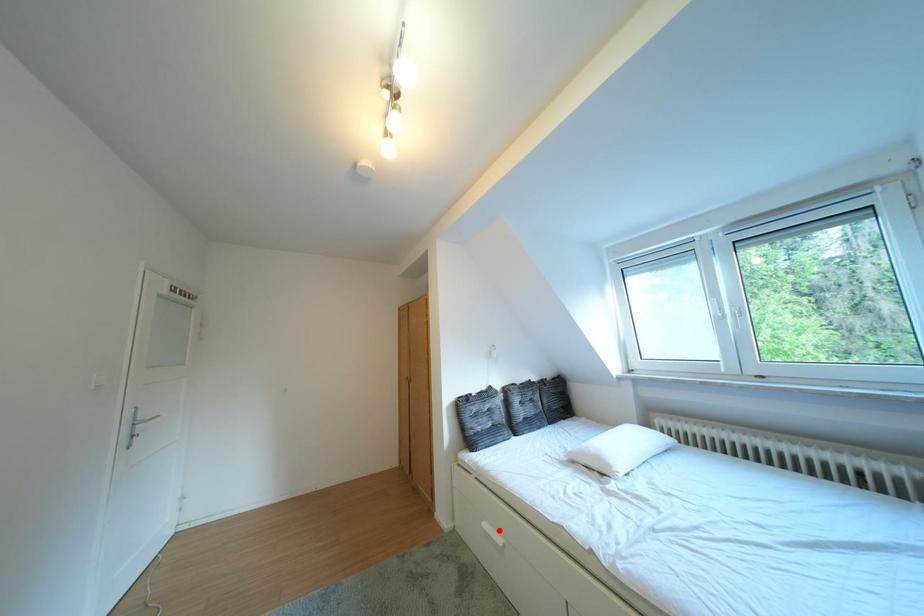
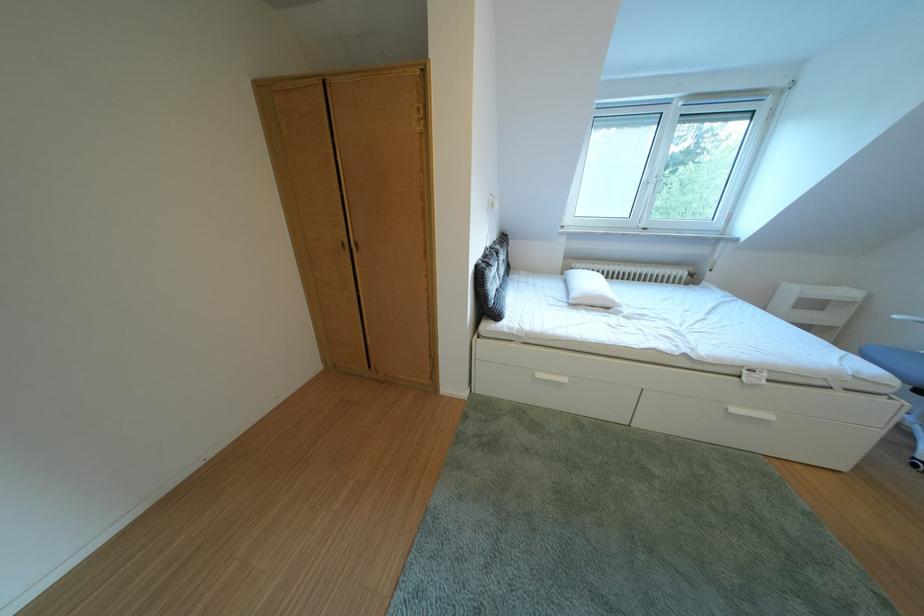
Locate, in the second image, the point that corresponds to the highlighted location in the first image.

(553, 381)